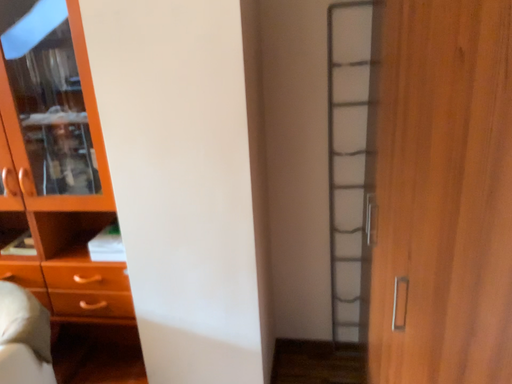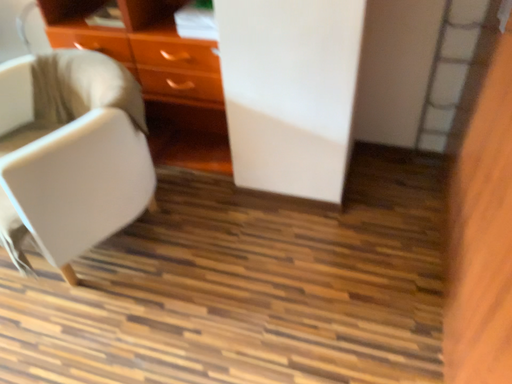
Question: How did the camera likely rotate when shooting the video?

Choices:
 (A) rotated left
 (B) rotated right

Answer: (A)